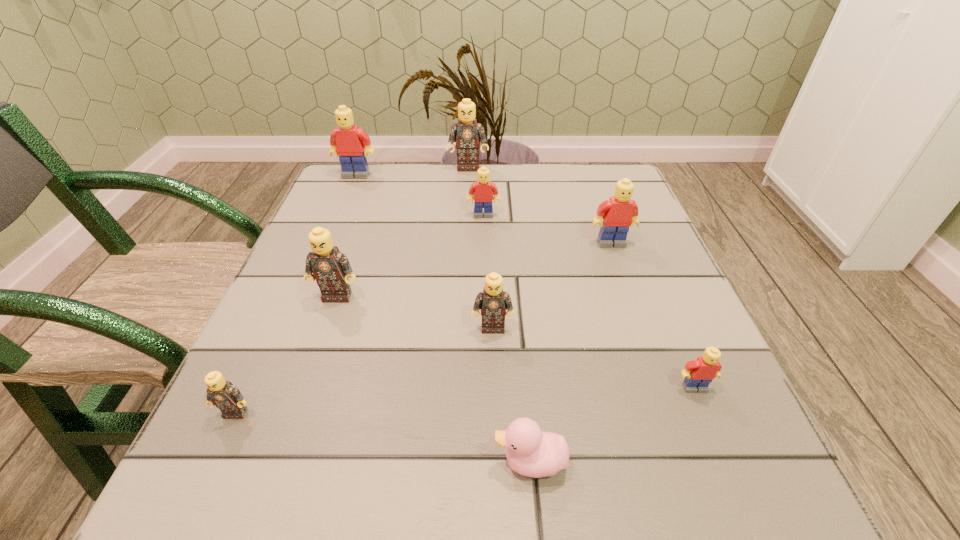
In the image, there is a desktop. Identify the location of free region at the left edge. (361, 237).

The width and height of the screenshot is (960, 540). I want to click on free point at the right edge, so click(738, 416).

At what (x,y) coordinates should I click in order to perform the action: click on vacant space at the near left corner. Please return your answer as a coordinate pair (x, y). This screenshot has width=960, height=540. Looking at the image, I should click on (305, 453).

Identify the location of empty space that is in between the duckling and the farthest yellow Lego. The height and width of the screenshot is (540, 960). (444, 319).

Where is `free space between the smallest tan Lego and the third nearest tan Lego`? The height and width of the screenshot is (540, 960). free space between the smallest tan Lego and the third nearest tan Lego is located at coordinates (286, 354).

Find the location of a particular element. Image resolution: width=960 pixels, height=540 pixels. free space between the duckling and the farthest yellow Lego is located at coordinates (444, 319).

Where is `free space between the fourth farthest Lego and the fourth nearest object`? free space between the fourth farthest Lego and the fourth nearest object is located at coordinates (552, 285).

Identify the location of vacant area that lies between the fifth nearest Lego and the pink duckling. The image size is (960, 540). (571, 353).

Find the location of `vacant region between the third farthest object and the nearest object`. vacant region between the third farthest object and the nearest object is located at coordinates (507, 339).

Locate an element on the screen. The height and width of the screenshot is (540, 960). vacant space that is in between the second nearest object and the fourth farthest Lego is located at coordinates (423, 328).